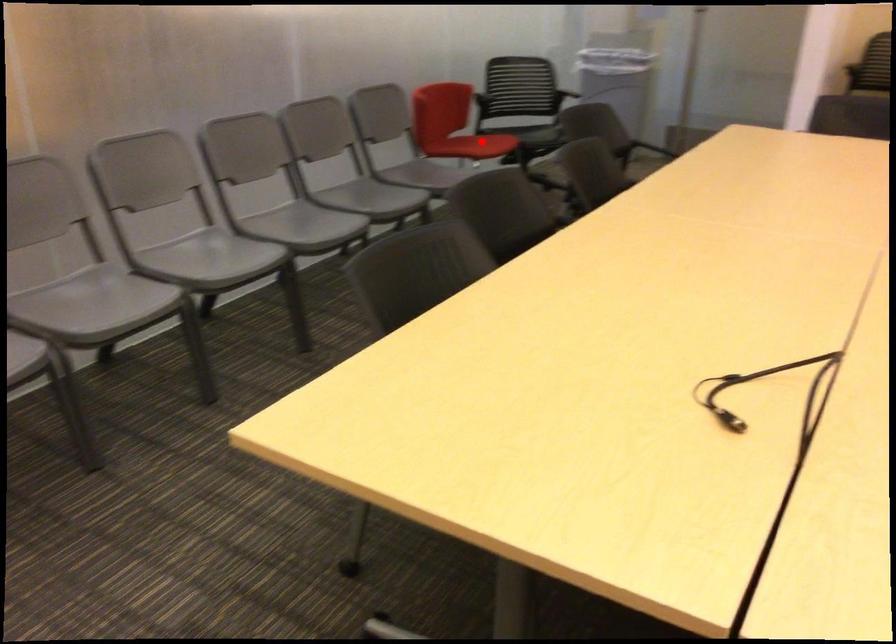
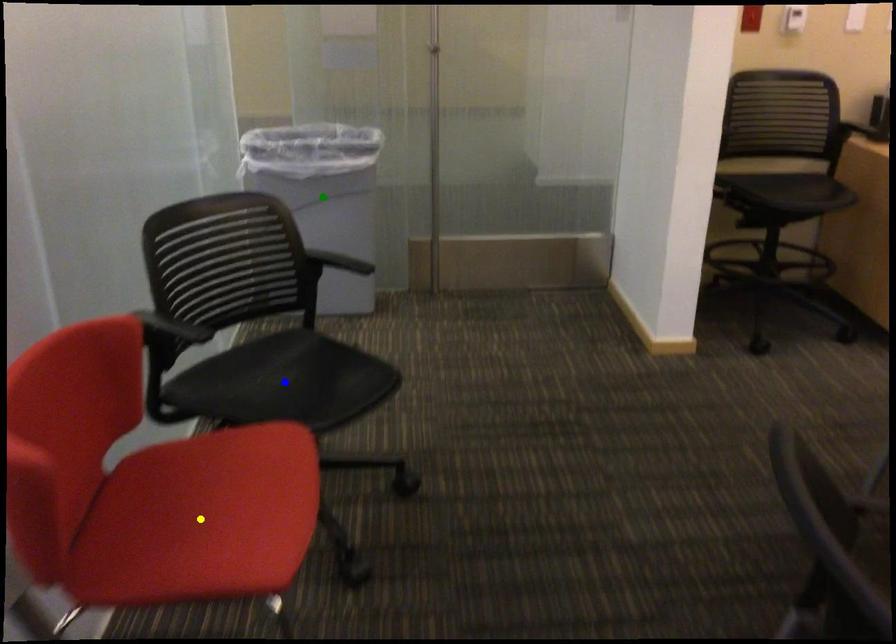
Question: I am providing you with two images of the same scene from different viewpoints. A red point is marked on the first image. You are given multiple points on the second image. Which mark in image 2 goes with the point in image 1?

Choices:
 (A) green point
 (B) yellow point
 (C) blue point

Answer: (B)